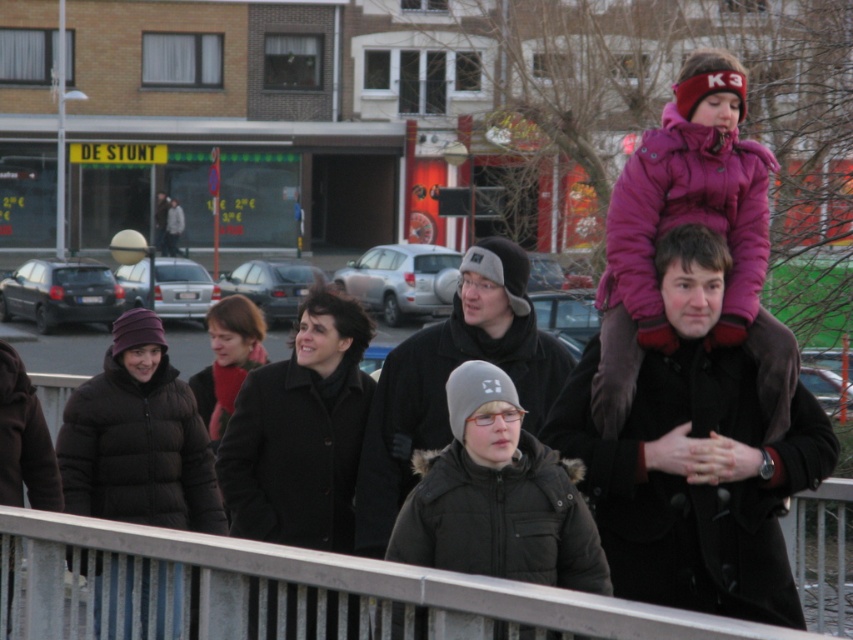
Locate an element on the screen. The image size is (853, 640). purple fuzzy coat at upper right is located at coordinates (691, 221).

Is purple fuzzy coat at upper right thinner than matte black coat at center?

Indeed, purple fuzzy coat at upper right has a lesser width compared to matte black coat at center.

Is point (699, 209) less distant than point (218, 323)?

Yes, point (699, 209) is closer to viewer.

I want to click on purple fuzzy coat at upper right, so click(x=691, y=221).

Can you confirm if dark brown coat at center is taller than matte black coat at center?

Correct, dark brown coat at center is much taller as matte black coat at center.

Which is above, dark brown coat at center or matte black coat at center?

matte black coat at center is above.

Is point (749, 358) more distant than point (212, 346)?

No, it is not.

This screenshot has height=640, width=853. I want to click on dark brown coat at center, so click(x=695, y=456).

Is dark brown coat at center smaller than black woolen coat at center?

No, dark brown coat at center is not smaller than black woolen coat at center.

Is point (770, 589) closer to camera compared to point (426, 413)?

Yes, point (770, 589) is closer to viewer.

Is point (718, 440) positioned in front of point (412, 387)?

Yes, point (718, 440) is in front of point (412, 387).

I want to click on dark brown coat at center, so 695,456.